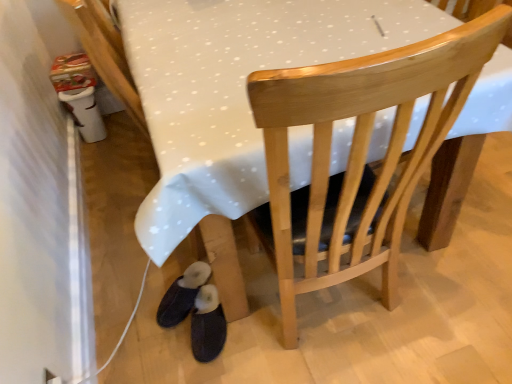
Where is `empty space that is to the right of wooden chair at center`? This screenshot has height=384, width=512. empty space that is to the right of wooden chair at center is located at coordinates (454, 286).